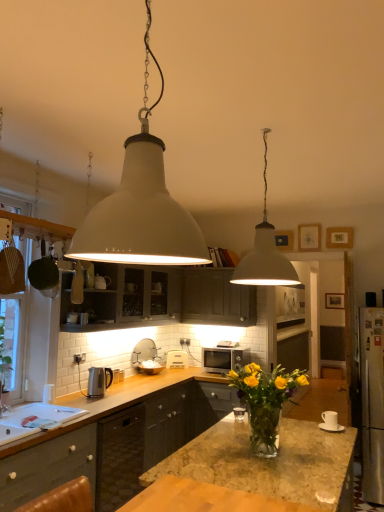
Identify the location of space that is in front of polished stainless steel kettle at lower left, which is the first appliance from top to bottom. Image resolution: width=384 pixels, height=512 pixels. (105, 398).